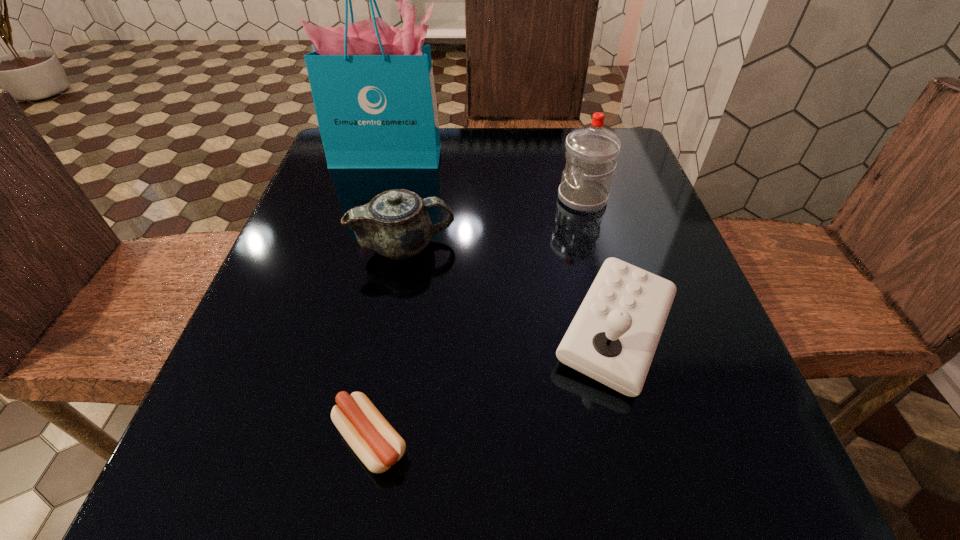
You are a GUI agent. You are given a task and a screenshot of the screen. Output one action in this format:
    pyautogui.click(x=<x>, y=<y>)
    Task: Click on the free region located on the handle side of the water bottle
    
    Given the screenshot: What is the action you would take?
    pyautogui.click(x=507, y=198)

You are a GUI agent. You are given a task and a screenshot of the screen. Output one action in this format:
    pyautogui.click(x=<x>, y=<y>)
    Task: Click on the free space located 0.200m on the handle side of the water bottle
    This screenshot has height=540, width=960.
    Given the screenshot: What is the action you would take?
    pyautogui.click(x=465, y=198)

At what (x,y) coordinates should I click in order to perform the action: click on vacant region located 0.360m from the spout of the third farthest object. Please return your answer as a coordinate pair (x, y). This screenshot has height=540, width=960. Looking at the image, I should click on (643, 246).

Locate an element on the screen. free location located 0.260m on the left of the joystick is located at coordinates (386, 331).

Find the location of a particular element. vacant space situated 0.310m on the back of the nearest object is located at coordinates (404, 253).

Where is `object that is at the far edge`? object that is at the far edge is located at coordinates (372, 84).

Find the location of a particular element. This screenshot has height=540, width=960. object located at the near edge is located at coordinates (376, 443).

Where is `shopping bag that is at the left edge`? Image resolution: width=960 pixels, height=540 pixels. shopping bag that is at the left edge is located at coordinates (372, 84).

Locate an element on the screen. This screenshot has width=960, height=540. chinaware that is at the left edge is located at coordinates (395, 223).

Find the location of `water bottle positioned at the right edge`. water bottle positioned at the right edge is located at coordinates (591, 153).